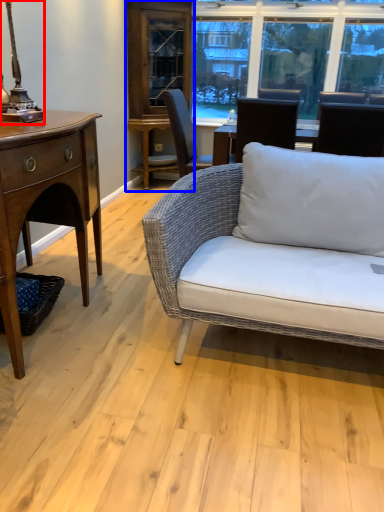
Question: Which of the following is the closest to the observer, table lamp (highlighted by a red box) or cabinetry (highlighted by a blue box)?

Choices:
 (A) table lamp
 (B) cabinetry

Answer: (A)